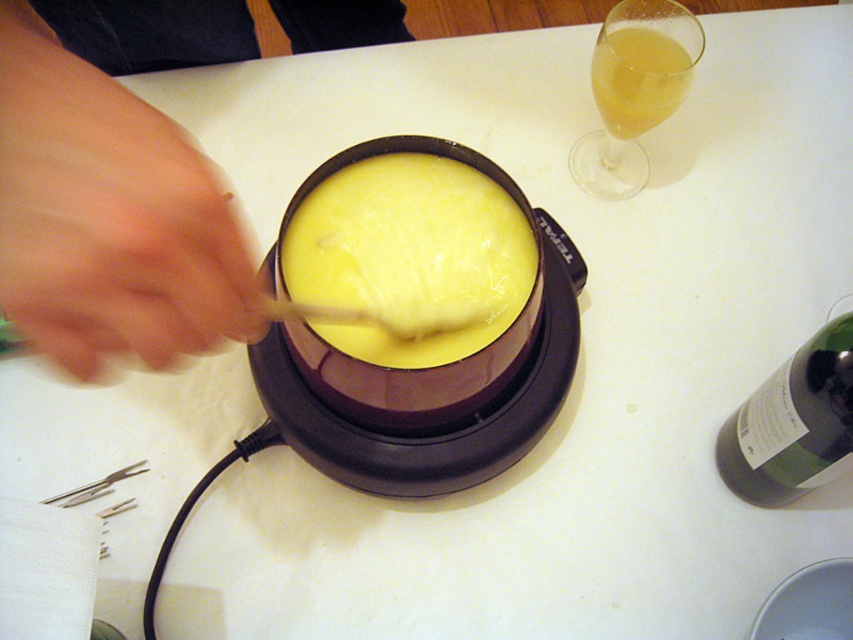
Can you confirm if green glass bottle at right is taller than translucent glass at upper right?

Yes.

Who is shorter, green glass bottle at right or translucent glass at upper right?

With less height is translucent glass at upper right.

The image size is (853, 640). Describe the element at coordinates (793, 422) in the screenshot. I see `green glass bottle at right` at that location.

You are a GUI agent. You are given a task and a screenshot of the screen. Output one action in this format:
    pyautogui.click(x=<x>, y=<y>)
    Task: Click on the green glass bottle at right
    The width and height of the screenshot is (853, 640).
    Given the screenshot: What is the action you would take?
    click(793, 422)

Based on the photo, does yellow creamy cheese at center come behind green glass bottle at right?

No, yellow creamy cheese at center is in front of green glass bottle at right.

I want to click on yellow creamy cheese at center, so click(409, 253).

Where is `yellow creamy cheese at center`? The image size is (853, 640). yellow creamy cheese at center is located at coordinates (409, 253).

Is skinny wooden stick at left above translucent glass at upper right?

Yes.

Can you confirm if skinny wooden stick at left is positioned below translucent glass at upper right?

No.

Does point (70, 314) come closer to viewer compared to point (641, 116)?

Yes, it is in front of point (641, 116).

Find the location of a particular element. This screenshot has height=640, width=853. skinny wooden stick at left is located at coordinates (114, 184).